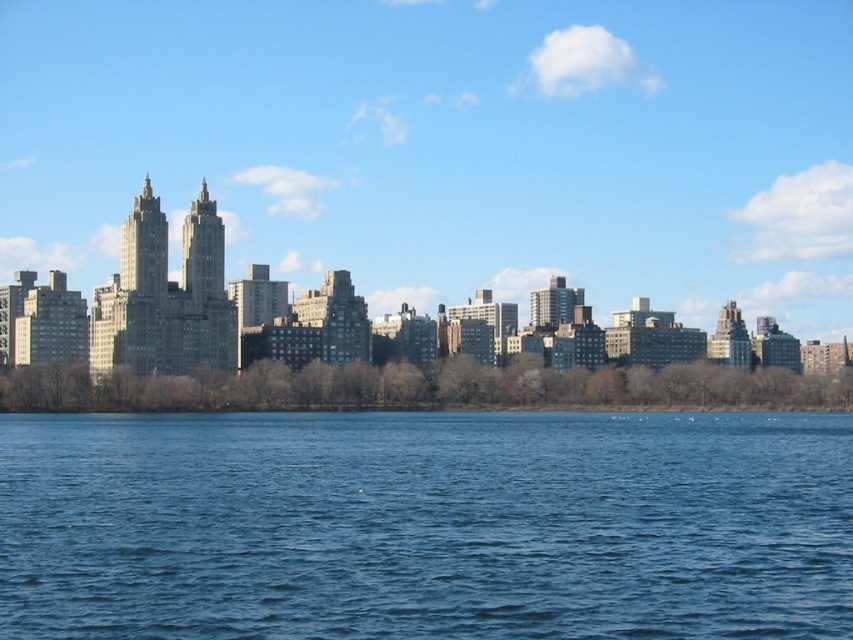
You are an architect analyzing the urban landscape. You notice a point marked at coordinates (448, 147). Based on the scene description, what architectural feature does this point highlight?

The point at (448, 147) highlights the transparent glass buildings at center, which are part of the city skyline showcasing a mix of architectural styles.

You are a drone operator trying to capture a photo of the blue liquid water at center and the gray concrete buildings at center. Which object appears taller in the image?

The gray concrete buildings at center are taller than the blue liquid water at center in the image.